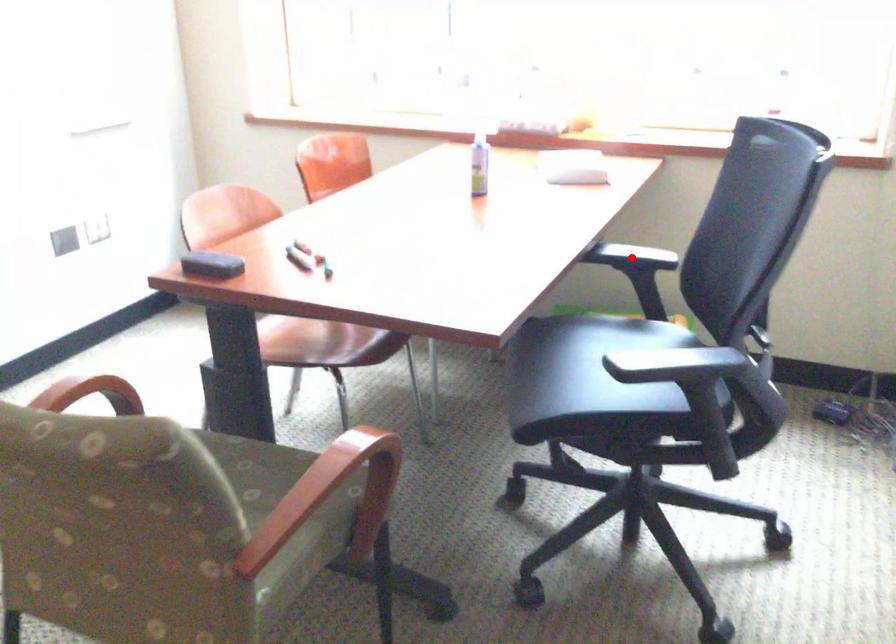
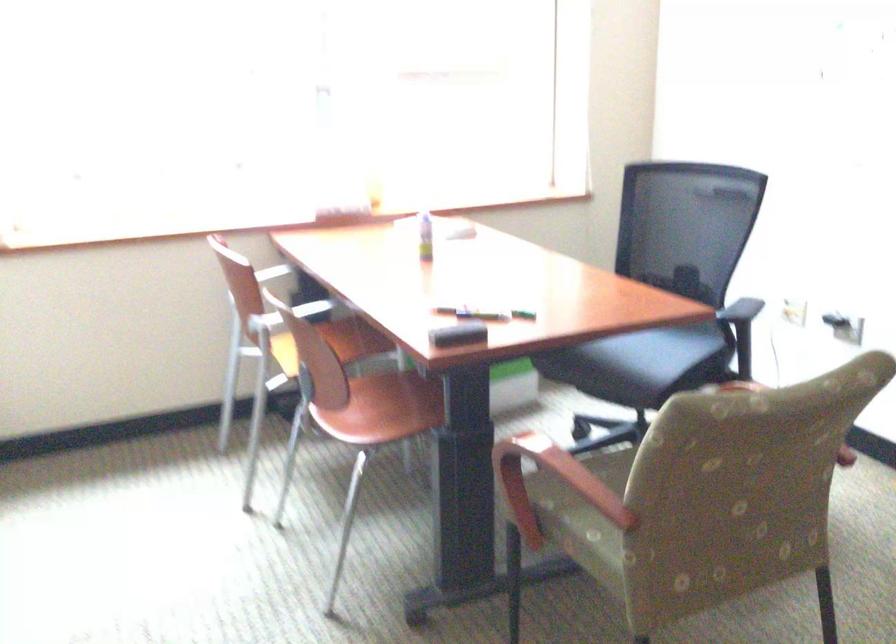
Question: I am providing you with two images of the same scene from different viewpoints. A red point is marked on the first image. Can you still see the location of the red point in image 2?

Choices:
 (A) Yes
 (B) No

Answer: (B)